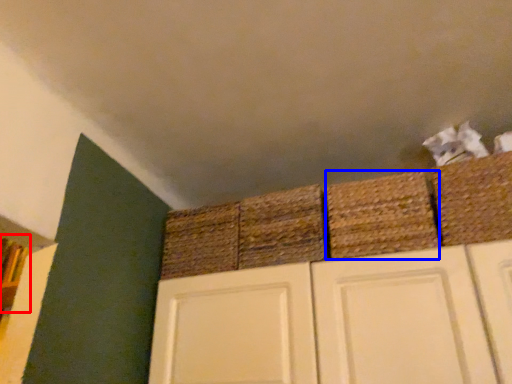
Question: Which object is closer to the camera taking this photo, shelf (highlighted by a red box) or basket (highlighted by a blue box)?

Choices:
 (A) shelf
 (B) basket

Answer: (B)